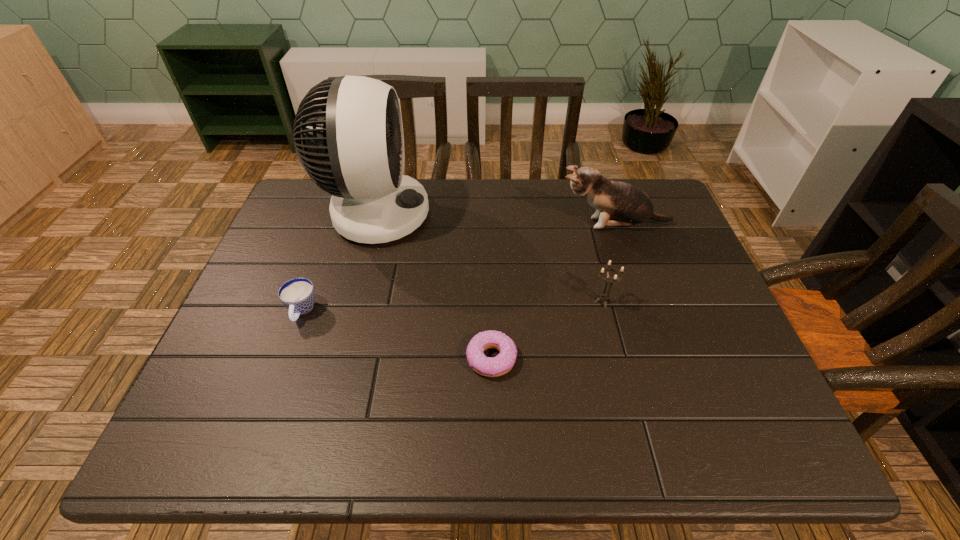
In the image, there is a desktop. Where is `vacant space at the far edge`? The width and height of the screenshot is (960, 540). vacant space at the far edge is located at coordinates (560, 183).

This screenshot has height=540, width=960. In the image, there is a desktop. Identify the location of vacant space at the near edge. (274, 449).

In order to click on vacant point at the left edge in this screenshot , I will do `click(228, 366)`.

Identify the location of vacant space at the right edge of the desktop. The height and width of the screenshot is (540, 960). (683, 245).

I want to click on vacant space in between the third object from right to left and the fourth shortest object, so click(552, 291).

Locate an element on the screen. This screenshot has height=540, width=960. vacant area that lies between the doughnut and the tallest object is located at coordinates (433, 286).

The height and width of the screenshot is (540, 960). What are the coordinates of `free space between the cat and the shortest object` in the screenshot? It's located at (552, 291).

I want to click on free space between the third tallest object and the nearest object, so click(547, 330).

The image size is (960, 540). In order to click on free space between the tallest object and the nearest object in this screenshot , I will do `click(433, 286)`.

In order to click on free spot between the shortest object and the fourth tallest object in this screenshot , I will do `click(396, 335)`.